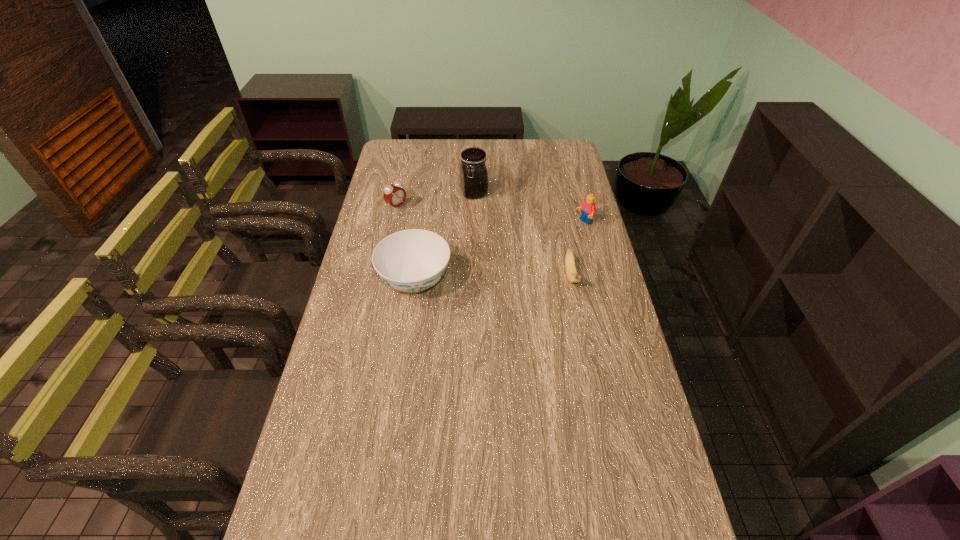
Where is `vacant space on the desktop that is between the chinaware and the shortest object and is positioned on the clock face of the alarm clock`? The height and width of the screenshot is (540, 960). vacant space on the desktop that is between the chinaware and the shortest object and is positioned on the clock face of the alarm clock is located at coordinates tap(508, 279).

Identify the location of vacant spot on the desktop that is between the chinaware and the shortest object and is positioned on the lid of the third object from left to right. This screenshot has width=960, height=540. (511, 279).

You are a GUI agent. You are given a task and a screenshot of the screen. Output one action in this format:
    pyautogui.click(x=<x>, y=<y>)
    Task: Click on the free spot on the desktop that is between the chinaware and the banana and is positioned on the face of the rightmost object
    This screenshot has width=960, height=540.
    Given the screenshot: What is the action you would take?
    pyautogui.click(x=479, y=280)